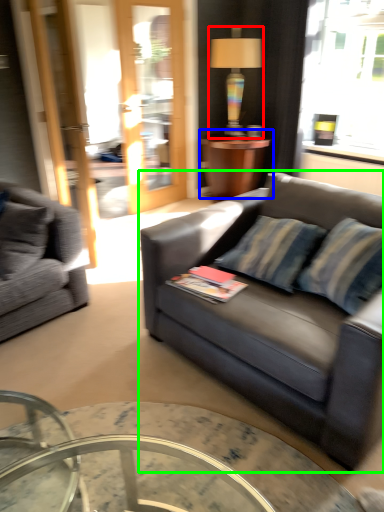
Question: Which object is positioned farthest from lamp (highlighted by a red box)? Select from table (highlighted by a blue box) and studio couch (highlighted by a green box).

Choices:
 (A) table
 (B) studio couch

Answer: (B)